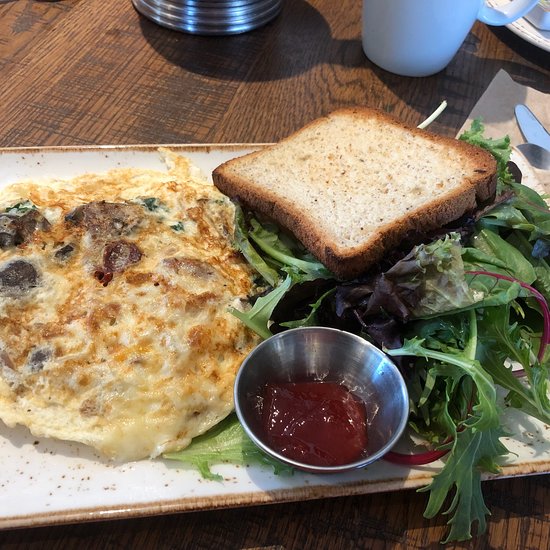
Identify the location of plate. (104, 478).